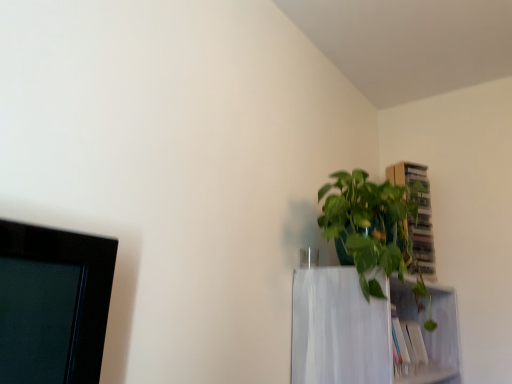
Question: Should I look upward or downward to see wooden cabinet at upper right?

Choices:
 (A) down
 (B) up

Answer: (A)

Question: Does white matte shelf at upper right have a lesser height compared to wooden cabinet at upper right?

Choices:
 (A) yes
 (B) no

Answer: (A)

Question: From a real-world perspective, is white matte shelf at upper right on top of wooden cabinet at upper right?

Choices:
 (A) no
 (B) yes

Answer: (A)

Question: From a real-world perspective, is white matte shelf at upper right positioned under wooden cabinet at upper right based on gravity?

Choices:
 (A) no
 (B) yes

Answer: (B)

Question: Is white matte shelf at upper right not within wooden cabinet at upper right?

Choices:
 (A) yes
 (B) no

Answer: (A)

Question: Is white matte shelf at upper right far from wooden cabinet at upper right?

Choices:
 (A) yes
 (B) no

Answer: (B)

Question: Is white matte shelf at upper right behind wooden cabinet at upper right?

Choices:
 (A) yes
 (B) no

Answer: (B)

Question: Considering the relative positions of wooden cabinet at upper right and white matte shelf at upper right in the image provided, is wooden cabinet at upper right to the right of white matte shelf at upper right from the viewer's perspective?

Choices:
 (A) yes
 (B) no

Answer: (A)

Question: From the image's perspective, is wooden cabinet at upper right located beneath white matte shelf at upper right?

Choices:
 (A) yes
 (B) no

Answer: (B)

Question: Would you say white matte shelf at upper right is part of wooden cabinet at upper right's contents?

Choices:
 (A) yes
 (B) no

Answer: (B)

Question: Is wooden cabinet at upper right thinner than white matte shelf at upper right?

Choices:
 (A) yes
 (B) no

Answer: (A)

Question: Is wooden cabinet at upper right positioned behind white matte shelf at upper right?

Choices:
 (A) yes
 (B) no

Answer: (A)

Question: Is wooden cabinet at upper right in front of white matte shelf at upper right?

Choices:
 (A) yes
 (B) no

Answer: (B)

Question: From a real-world perspective, is green glossy plant at upper right positioned over white matte shelf at upper right based on gravity?

Choices:
 (A) yes
 (B) no

Answer: (A)